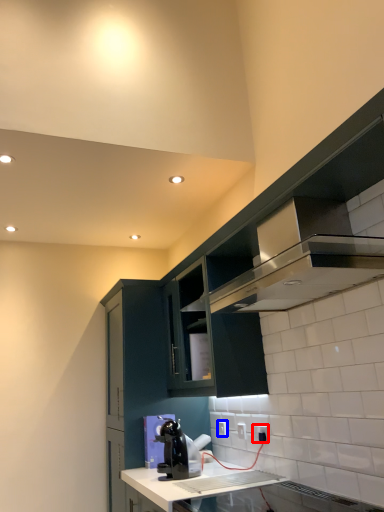
Question: Which object appears farthest to the camera in this image, electric outlet (highlighted by a red box) or electric outlet (highlighted by a blue box)?

Choices:
 (A) electric outlet
 (B) electric outlet

Answer: (B)